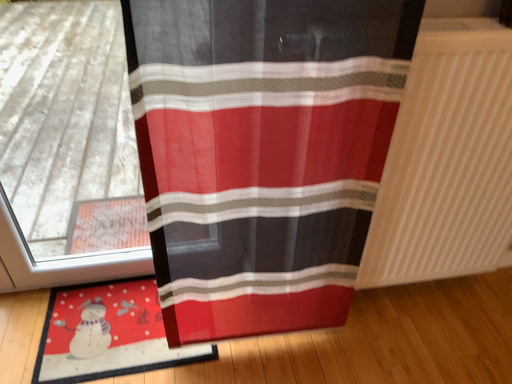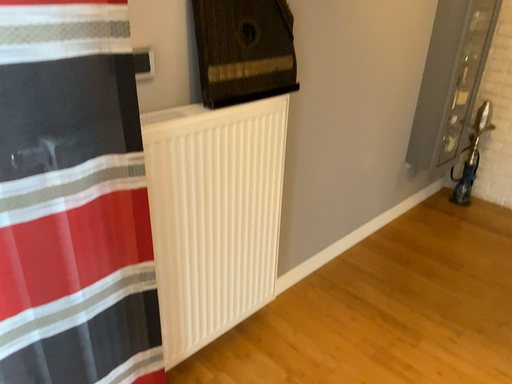
Question: How did the camera likely rotate when shooting the video?

Choices:
 (A) rotated left
 (B) rotated right

Answer: (B)